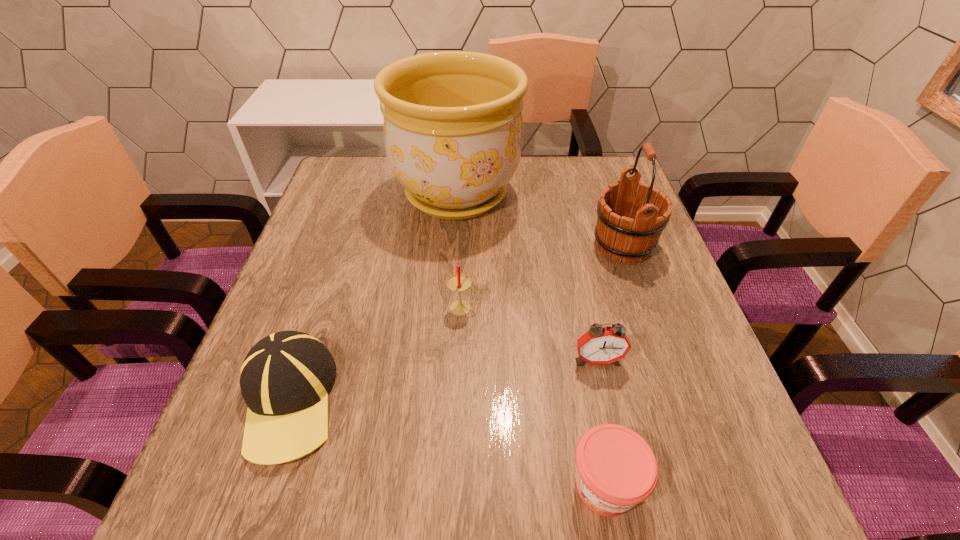
Where is `unoccupied position between the wine bucket and the candle`? The image size is (960, 540). unoccupied position between the wine bucket and the candle is located at coordinates (543, 277).

Find the location of `vacant space that's between the baseball cap and the candle`. vacant space that's between the baseball cap and the candle is located at coordinates (375, 354).

I want to click on vacant space in between the flowerpot and the fourth nearest object, so click(x=460, y=251).

Locate which object is the fifth closest to the second tallest object. Please provide its 2D coordinates. Your answer should be formatted as a tuple, i.e. [(x, y)], where the tuple contains the x and y coordinates of a point satisfying the conditions above.

[(285, 378)]

Locate which object is the closest to the flowerpot. Please provide its 2D coordinates. Your answer should be formatted as a tuple, i.e. [(x, y)], where the tuple contains the x and y coordinates of a point satisfying the conditions above.

[(631, 238)]